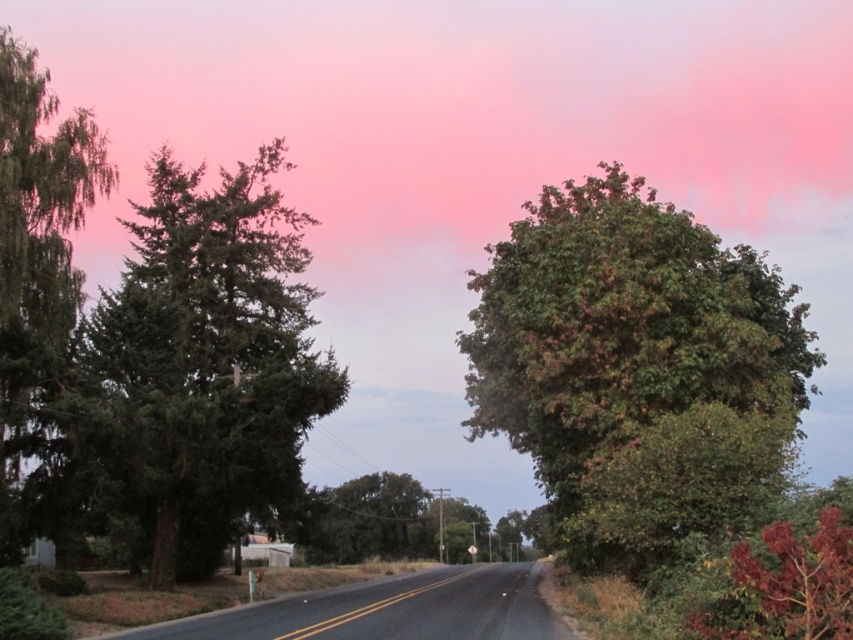
You are driving a car that is 5 meters long. You want to park your car between the green matte tree at left and the green leafy tree at center. Is there enough space between them to park your car?

The distance between the green matte tree at left and the green leafy tree at center is 20.50 meters. Since your car is only 5 meters long, there is more than enough space to park between them.

You are standing at the center of the road and want to take a photo of the green matte tree at left. Which direction should you face to capture it in your camera?

You should face to the left to capture the green matte tree at left since it is located at the left side of the road.